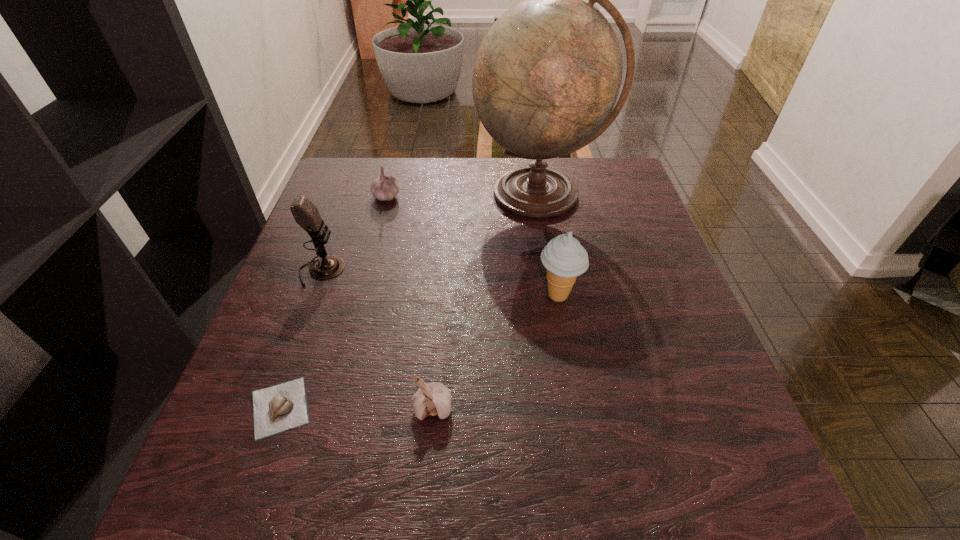
You are a GUI agent. You are given a task and a screenshot of the screen. Output one action in this format:
    pyautogui.click(x=<x>, y=<y>)
    Task: Click on the globe
    The height and width of the screenshot is (540, 960).
    Given the screenshot: What is the action you would take?
    pyautogui.click(x=547, y=75)

The width and height of the screenshot is (960, 540). What are the coordinates of `microphone` in the screenshot? It's located at (306, 214).

Locate an element on the screen. The height and width of the screenshot is (540, 960). icecream is located at coordinates (564, 258).

Find the location of `the farthest garlic`. the farthest garlic is located at coordinates (384, 188).

You are a GUI agent. You are given a task and a screenshot of the screen. Output one action in this format:
    pyautogui.click(x=<x>, y=<y>)
    Task: Click on the fourth object from left to right
    The width and height of the screenshot is (960, 540).
    Given the screenshot: What is the action you would take?
    pyautogui.click(x=434, y=398)

The image size is (960, 540). I want to click on the shortest object, so click(276, 409).

You are a GUI agent. You are given a task and a screenshot of the screen. Output one action in this format:
    pyautogui.click(x=<x>, y=<y>)
    Task: Click on the free space located on the front-facing side of the globe
    This screenshot has width=960, height=540.
    Given the screenshot: What is the action you would take?
    pyautogui.click(x=555, y=283)

Image resolution: width=960 pixels, height=540 pixels. Identify the location of blank space located on the front-facing side of the microphone. (458, 271).

Image resolution: width=960 pixels, height=540 pixels. What are the coordinates of `free spot located on the right of the icecream` in the screenshot? It's located at (658, 295).

Find the location of a particular element. Image resolution: width=960 pixels, height=540 pixels. free space located 0.290m on the right of the farthest garlic is located at coordinates (510, 196).